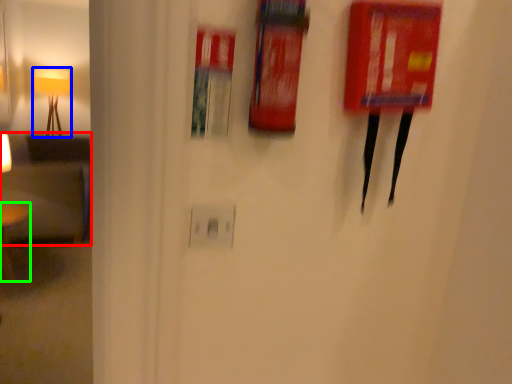
Question: Considering the real-world distances, which object is closest to armchair (highlighted by a red box)? lamp (highlighted by a blue box) or furniture (highlighted by a green box).

Choices:
 (A) lamp
 (B) furniture

Answer: (B)